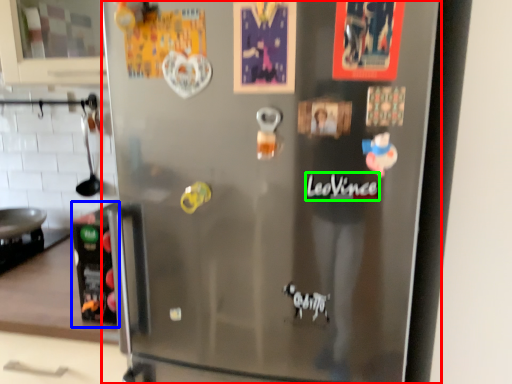
Question: Which object is positioned closest to refrigerator (highlighted by a red box)? Select from appliance (highlighted by a blue box) and writing (highlighted by a green box).

Choices:
 (A) appliance
 (B) writing

Answer: (A)